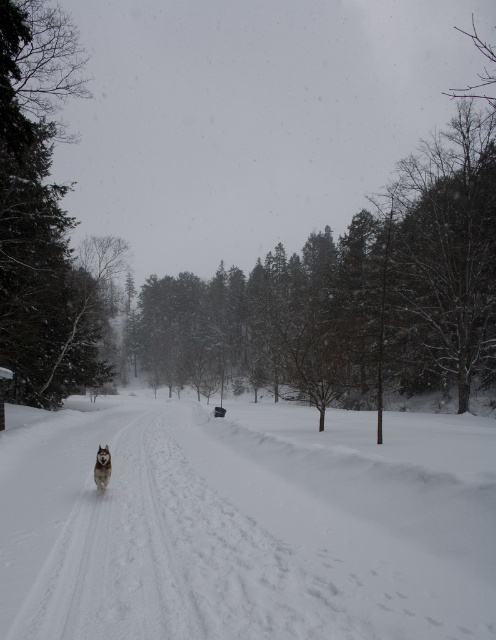
Question: Can you confirm if white fluffy snow at center is positioned below white fluffy dog at center?

Choices:
 (A) yes
 (B) no

Answer: (A)

Question: Which point appears closest to the camera in this image?

Choices:
 (A) (106, 477)
 (B) (5, 573)

Answer: (B)

Question: Which object is farther from the camera taking this photo?

Choices:
 (A) white fluffy dog at center
 (B) white fluffy snow at center

Answer: (A)

Question: Does white fluffy snow at center have a greater width compared to white fluffy dog at center?

Choices:
 (A) no
 (B) yes

Answer: (B)

Question: Which object appears closest to the camera in this image?

Choices:
 (A) white fluffy snow at center
 (B) white fluffy dog at center

Answer: (A)

Question: Can you confirm if white fluffy snow at center is positioned above white fluffy dog at center?

Choices:
 (A) no
 (B) yes

Answer: (A)